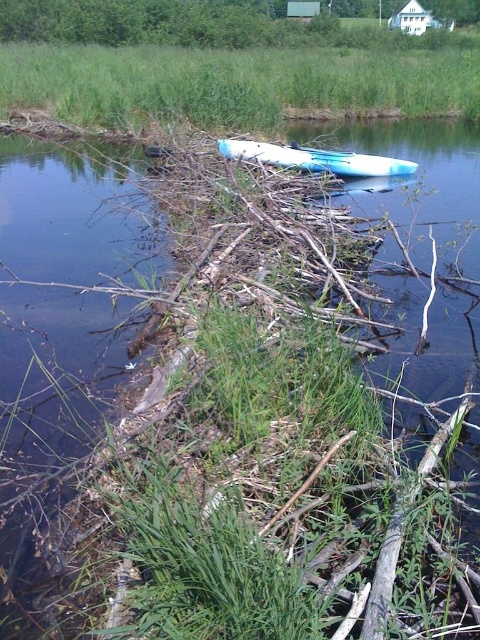
Between green grass at center and blue glossy kayak at center, which one appears on the left side from the viewer's perspective?

From the viewer's perspective, green grass at center appears more on the left side.

Which of these two, green grass at center or blue glossy kayak at center, stands taller?

green grass at center is taller.

Does point (196, 116) come farther from viewer compared to point (253, 145)?

That is True.

Locate an element on the screen. This screenshot has height=640, width=480. green grass at center is located at coordinates (231, 83).